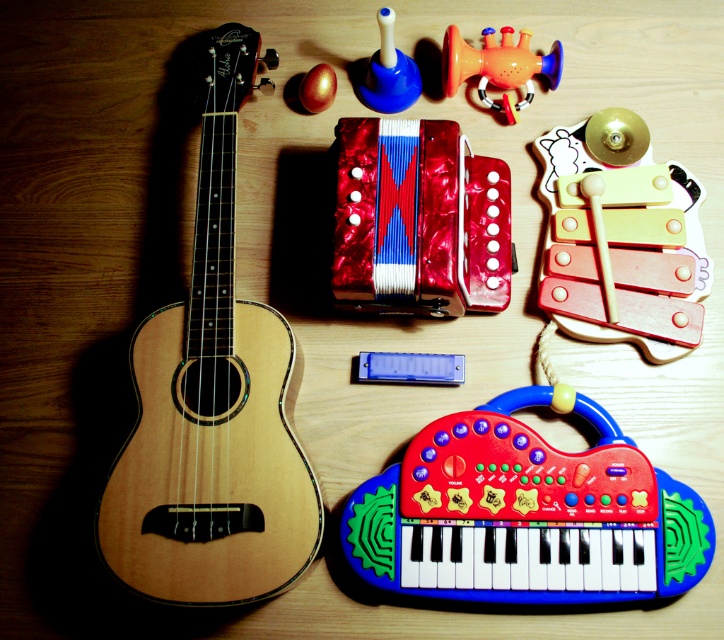
You are organizing a childrens music class and need to place a 12 inch wide music book between the natural wood guitar at left and the rubberized plastic keyboard at bottom center. Is there enough space?

The natural wood guitar at left is 10.44 inches away from the rubberized plastic keyboard at bottom center. Since the music book is 12 inches wide, there is not enough space to place it between them.